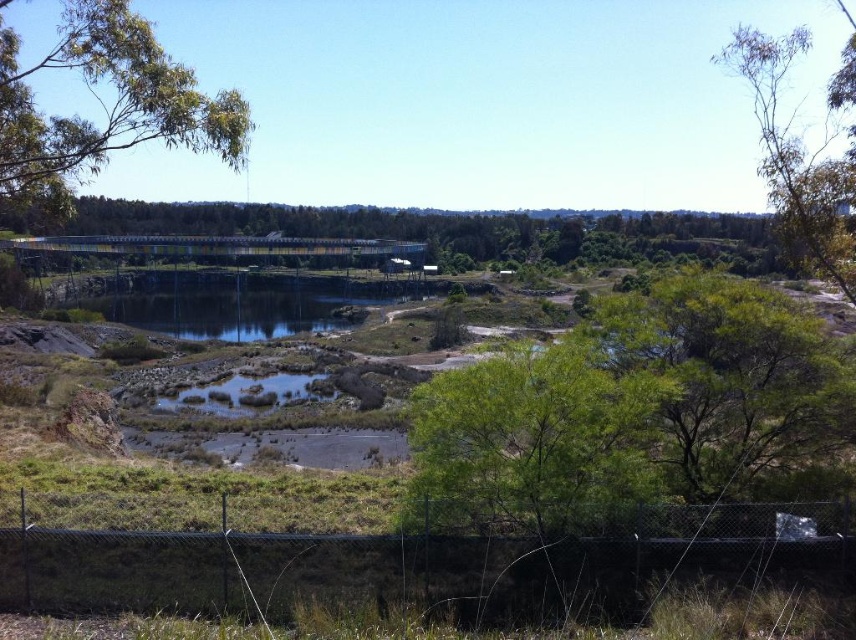
You are a bird looking for a nesting spot. You see two trees in the image, the green leafy tree at center and the green leafy tree at upper left. Which tree would you choose if you prefer a smaller tree for nesting?

The green leafy tree at center is smaller compared to the green leafy tree at upper left, so the bird would choose the green leafy tree at center for nesting.

You are a bird flying over the landscape and want to land near the clear water at center. Which direction should you head from the green leafy tree at upper right?

You should head downward from the green leafy tree at upper right to reach the clear water at center because the green leafy tree at upper right is above clear water at center.